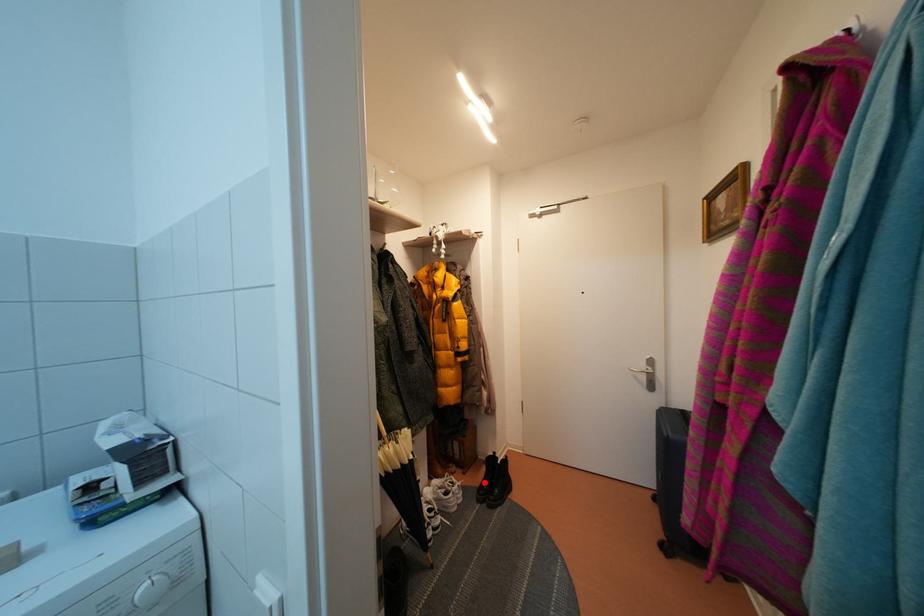
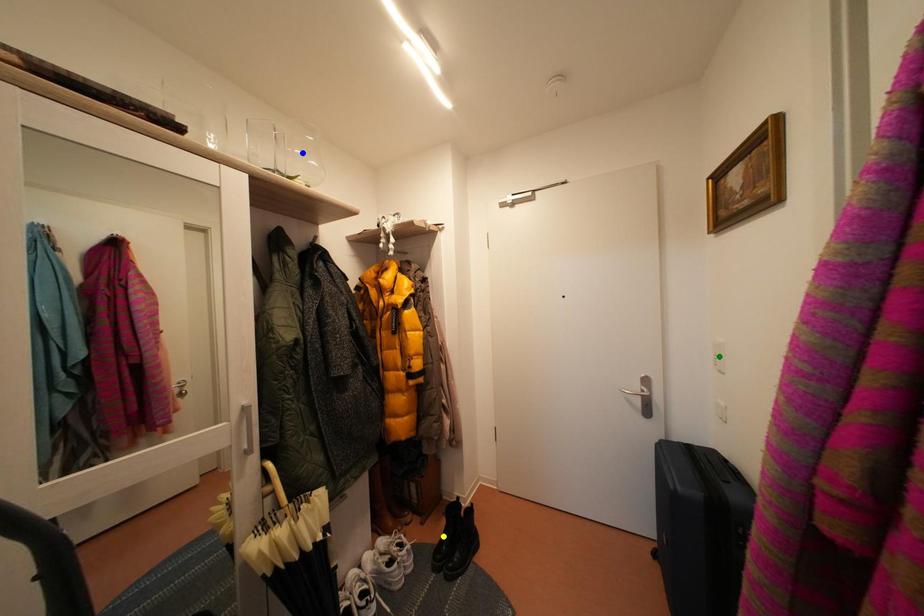
Question: I am providing you with two images of the same scene from different viewpoints. A red point is marked on the first image. You are given multiple points on the second image. Which point in image 2 is actually the same real-world point as the red point in image 1?

Choices:
 (A) green point
 (B) blue point
 (C) yellow point

Answer: (C)